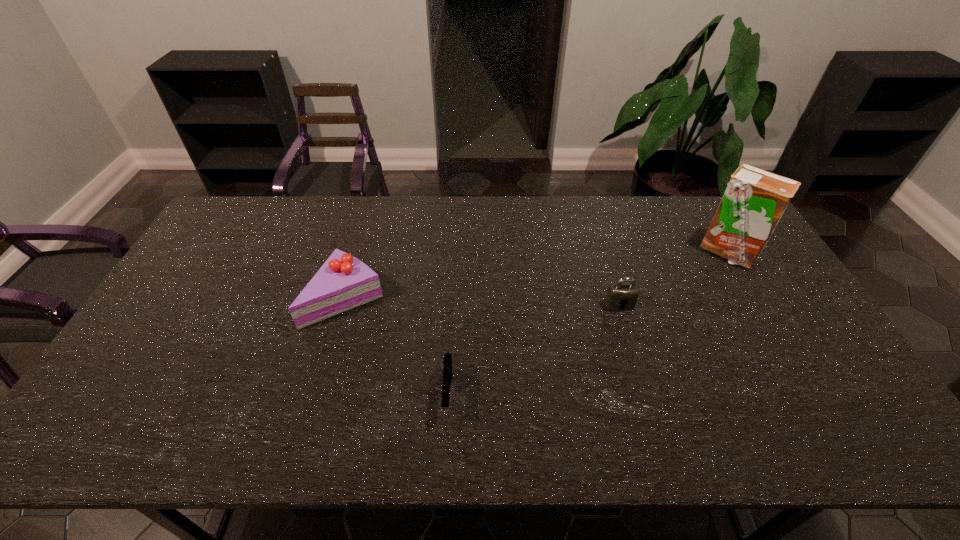
Where is `vacant area between the padlock and the tallest object`? vacant area between the padlock and the tallest object is located at coordinates 673,279.

The width and height of the screenshot is (960, 540). I want to click on vacant space that's between the nearest object and the leftmost object, so click(x=397, y=345).

At what (x,y) coordinates should I click in order to perform the action: click on vacant point located between the carton and the cake. Please return your answer as a coordinate pair (x, y). Image resolution: width=960 pixels, height=540 pixels. Looking at the image, I should click on (537, 275).

Locate an element on the screen. Image resolution: width=960 pixels, height=540 pixels. vacant space that is in between the shortest object and the carton is located at coordinates (588, 322).

Where is `free spot between the second object from right to left and the rightmost object`? free spot between the second object from right to left and the rightmost object is located at coordinates [673, 279].

This screenshot has height=540, width=960. Identify the location of vacant space that's between the padlock and the nearest object. (534, 349).

The width and height of the screenshot is (960, 540). What are the coordinates of `blank region between the pistol and the leftmost object` in the screenshot? It's located at (397, 345).

Identify which object is located as the nearest to the pistol. Please provide its 2D coordinates. Your answer should be formatted as a tuple, i.e. [(x, y)], where the tuple contains the x and y coordinates of a point satisfying the conditions above.

[(343, 282)]

Identify the location of object identified as the second closest to the pistol. The image size is (960, 540). (620, 296).